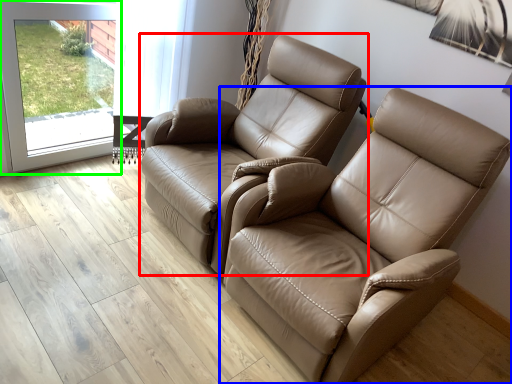
Question: Based on their relative distances, which object is farther from chair (highlighted by a red box)? Choose from chair (highlighted by a blue box) and screen door (highlighted by a green box).

Choices:
 (A) chair
 (B) screen door

Answer: (B)